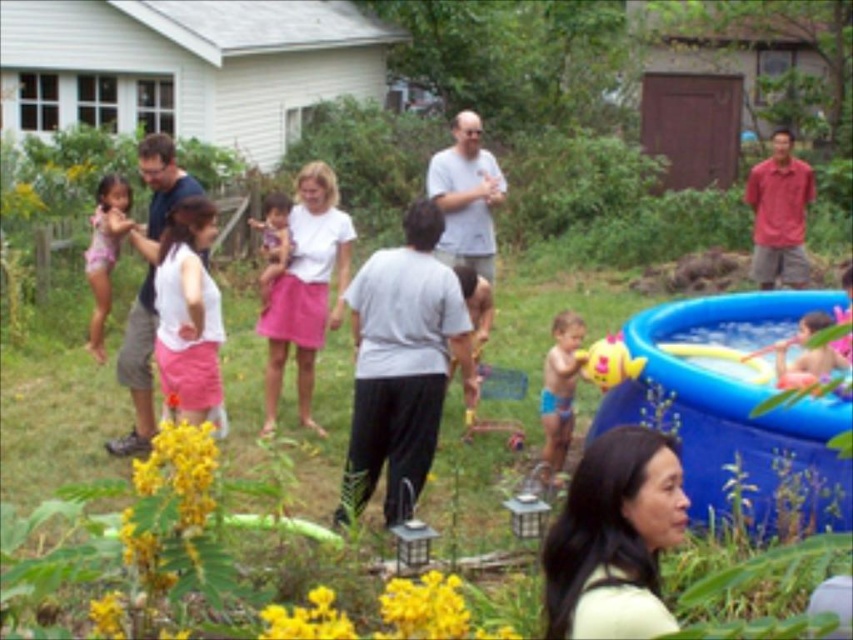
Question: Is white matte shirt at center below blue fabric shorts at center?

Choices:
 (A) no
 (B) yes

Answer: (A)

Question: Which of the following is the closest to the observer?

Choices:
 (A) white matte shirt at center
 (B) pink fabric swimsuit at left
 (C) smooth plastic toy at right
 (D) matte gray shirt at left

Answer: (A)

Question: Estimate the real-world distances between objects in this image. Which object is farther from the smooth plastic toy at right?

Choices:
 (A) blue inflatable pool at lower right
 (B) blue fabric shorts at center
 (C) matte pink skirt at center
 (D) white matte shirt at center

Answer: (D)

Question: Does blue inflatable pool at lower right appear over blue fabric shorts at center?

Choices:
 (A) yes
 (B) no

Answer: (A)

Question: Which of the following is the closest to the observer?

Choices:
 (A) blue inflatable pool at lower right
 (B) white cotton shirt at center
 (C) matte gray shirt at left

Answer: (A)

Question: Does pink fabric swimsuit at left have a larger size compared to matte pink skirt at center?

Choices:
 (A) no
 (B) yes

Answer: (B)